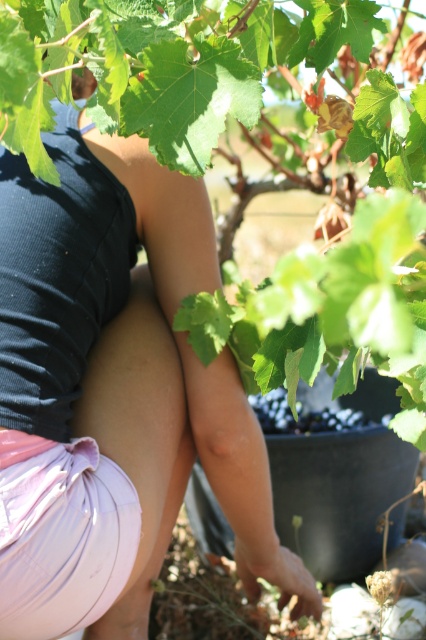
Does point (287, 577) come behind point (279, 428)?

No.

Does pink fabric at lower left appear on the right side of black matte grape at center?

No, pink fabric at lower left is not to the right of black matte grape at center.

The width and height of the screenshot is (426, 640). Identify the location of pink fabric at lower left. (112, 392).